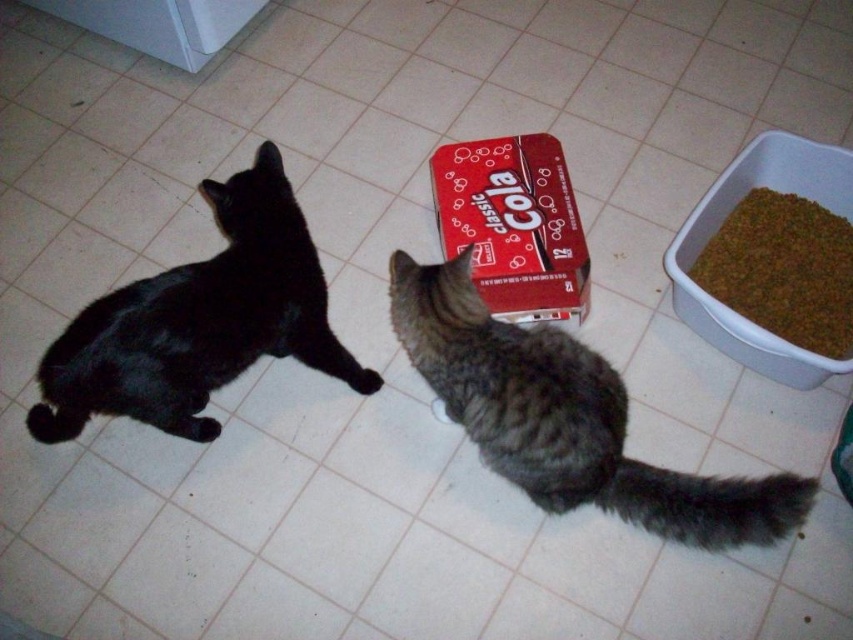
Is red cardboard box at center to the right of brown granular food at right from the viewer's perspective?

Incorrect, red cardboard box at center is not on the right side of brown granular food at right.

Does red cardboard box at center come in front of brown granular food at right?

No, red cardboard box at center is behind brown granular food at right.

Between point (519, 154) and point (772, 275), which one is positioned behind?

Positioned behind is point (519, 154).

At what (x,y) coordinates should I click in order to perform the action: click on red cardboard box at center. Please return your answer as a coordinate pair (x, y). The width and height of the screenshot is (853, 640). Looking at the image, I should click on (514, 225).

Between gray striped fur cat at center and matte black cat at left, which one has less height?

gray striped fur cat at center

Does gray striped fur cat at center have a lesser height compared to matte black cat at left?

Indeed, gray striped fur cat at center has a lesser height compared to matte black cat at left.

You are a GUI agent. You are given a task and a screenshot of the screen. Output one action in this format:
    pyautogui.click(x=<x>, y=<y>)
    Task: Click on the gray striped fur cat at center
    
    Given the screenshot: What is the action you would take?
    pos(566,417)

From the picture: Does matte black cat at left have a greater width compared to brown granular food at right?

Yes, matte black cat at left is wider than brown granular food at right.

Which is behind, point (200, 188) or point (811, 298)?

Positioned behind is point (200, 188).

Does point (312, 342) come closer to viewer compared to point (845, 305)?

That is True.

Where is `matte black cat at left`? matte black cat at left is located at coordinates (199, 321).